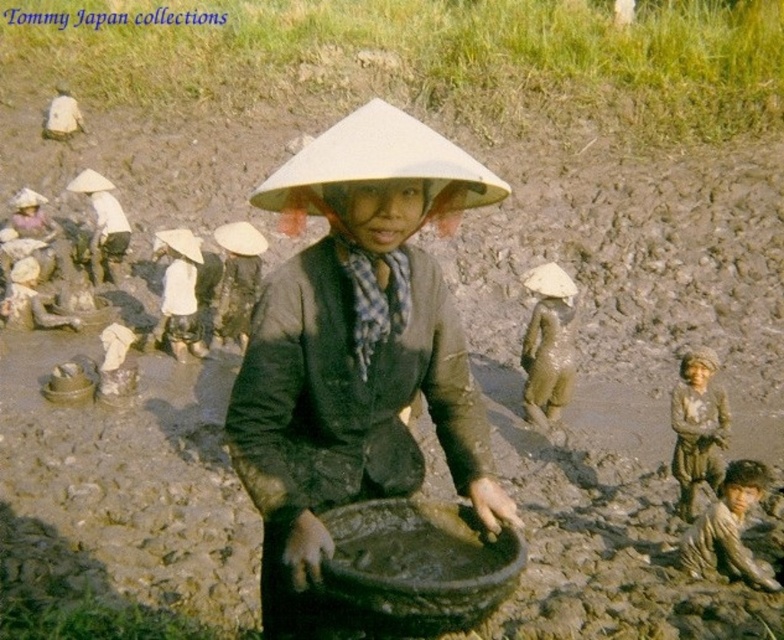
You are a photographer aiming to capture the central figure in the scene. You notice the muddy skin at center and the white fabric hat at center. Which object should you focus on if you want to highlight something that is thinner?

The muddy skin at center is thinner than the white fabric hat at center, so focusing on the muddy skin at center would highlight the thinner object.

You are a photographer standing in the center of the field. You want to take a photo of the dirty brown skin at lower right. Where should you point your camera to capture it in the frame?

You should point your camera towards the lower right direction, specifically at the coordinates point [728,529], to capture the dirty brown skin at lower right in the frame.

You are a farmer standing near the brown textured fabric at lower right and the dirty brown skin at lower right. You need to place a small seedling between them. Is there enough space to fit the seedling without overlapping either object?

The distance between the brown textured fabric at lower right and the dirty brown skin at lower right is 62.43 centimeters. Since the seedling requires minimal space, there is sufficient room to place it between them without overlapping either object.